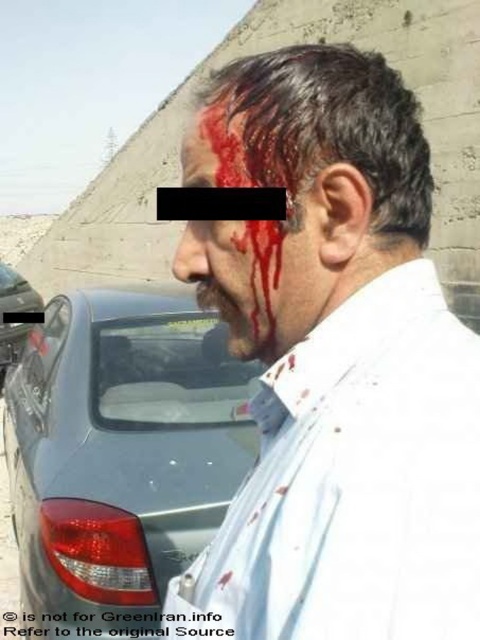
You are a drone operator trying to locate two points in an emergency scene. The first point is at coordinate point (x=132, y=310) and the second is at point (x=1, y=326). Which point is closer to the camera to prioritize for immediate aerial inspection?

Point (x=132, y=310) is closer to the camera than point (x=1, y=326), so the drone should prioritize inspecting point (x=132, y=310) first.

You are a drone operator trying to locate two points in an emergency scene. The first point is at coordinates point (365, 476) and the second is at point (15, 294). Which point is closer to the camera?

Point (365, 476) is closer to the camera than point (15, 294).

You are a first responder arriving at the scene. You see the white matte shirt at center and the metallic silver car at left. Which object is closer to you? Please explain your reasoning based on their positions.

The white matte shirt at center is closer to you because it is positioned in front of the metallic silver car at left, indicating it is nearer in the visual plane.